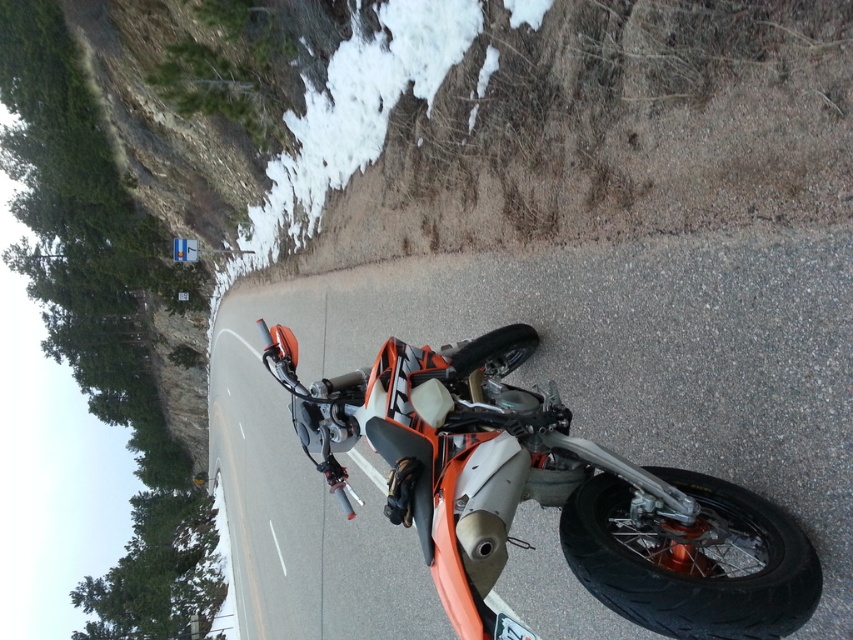
Question: Can you confirm if orange matte/satin motorcycle at center is wider than black rubber tire at lower right?

Choices:
 (A) yes
 (B) no

Answer: (A)

Question: Considering the real-world distances, which object is closest to the black rubber tire at lower right?

Choices:
 (A) white powdery snow at upper center
 (B) orange matte/satin motorcycle at center

Answer: (B)

Question: Does orange matte/satin motorcycle at center appear on the left side of black rubber tire at lower center?

Choices:
 (A) yes
 (B) no

Answer: (B)

Question: Which object appears closest to the camera in this image?

Choices:
 (A) white powdery snow at upper center
 (B) orange matte/satin motorcycle at center
 (C) black rubber tire at lower center

Answer: (B)

Question: Is black rubber tire at lower right above white powdery snow at upper center?

Choices:
 (A) no
 (B) yes

Answer: (A)

Question: Which of the following is the farthest from the observer?

Choices:
 (A) (607, 556)
 (B) (457, 362)

Answer: (B)